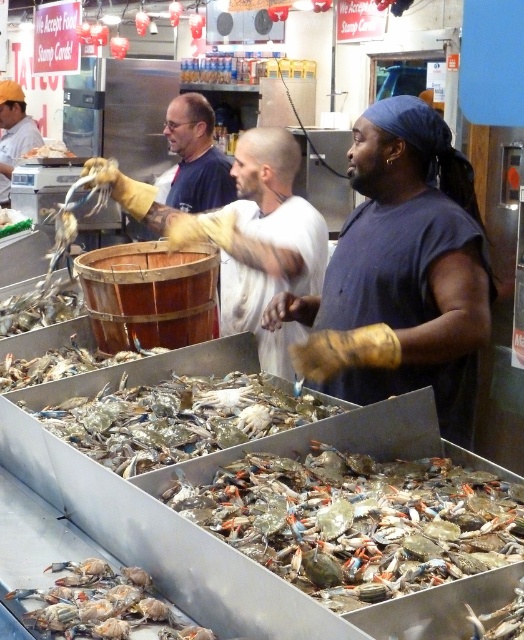
You are a market worker who needs to place the translucent plastic crab at lower left into the wooden barrel at center. Based on their sizes, will the crab fit inside the barrel?

The wooden barrel at center is wider than the translucent plastic crab at lower left, so the crab will fit inside the barrel.

You are a food safety inspector checking the seafood market. You notice the yellow rubber gloves at center and the translucent plastic crabs at center. Which item is taller?

The yellow rubber gloves at center are much taller than the translucent plastic crabs at center.